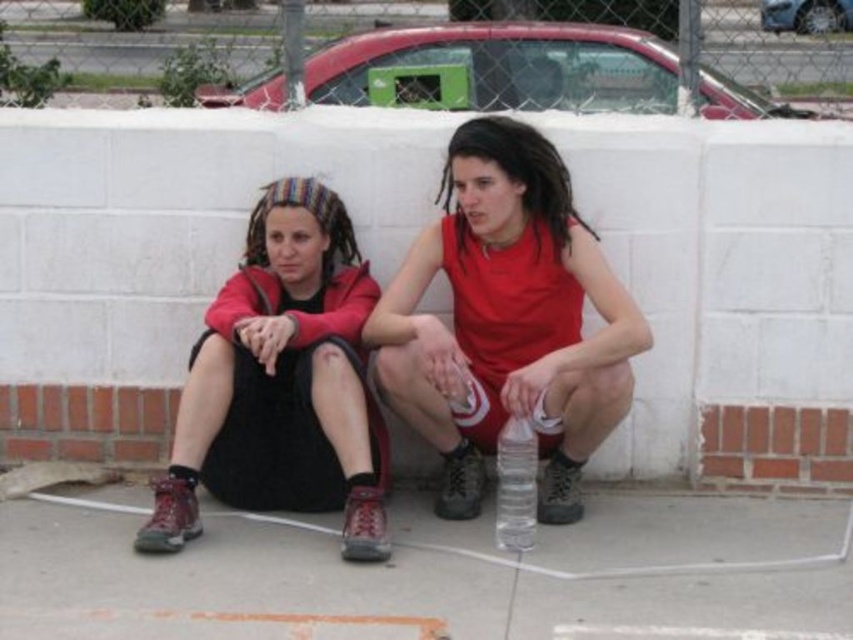
Question: Is clear concrete pavement at lower center closer to camera compared to red matte tank top at center?

Choices:
 (A) no
 (B) yes

Answer: (B)

Question: Which point is closer to the camera?

Choices:
 (A) red matte tank top at center
 (B) matte red jacket at center

Answer: (B)

Question: Which of the following is the closest to the observer?

Choices:
 (A) matte red jacket at center
 (B) clear concrete pavement at lower center

Answer: (B)

Question: Is clear concrete pavement at lower center in front of matte red jacket at center?

Choices:
 (A) yes
 (B) no

Answer: (A)

Question: Can you confirm if red matte tank top at center is wider than matte red jacket at center?

Choices:
 (A) yes
 (B) no

Answer: (A)

Question: Based on their relative distances, which object is nearer to the matte red jacket at center?

Choices:
 (A) clear concrete pavement at lower center
 (B) red matte tank top at center

Answer: (B)